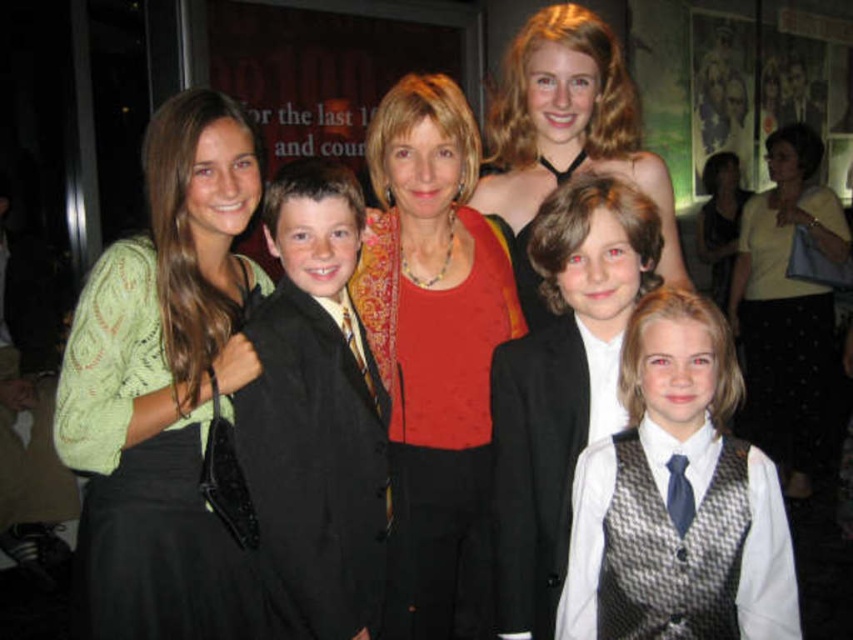
You are a photographer trying to adjust your camera focus. You have two points in the image you need to focus on, point (219, 564) and point (328, 369). Which point is closer to the camera?

Point (219, 564) is further to the camera than point (328, 369), so the closer point to the camera is point (328, 369).